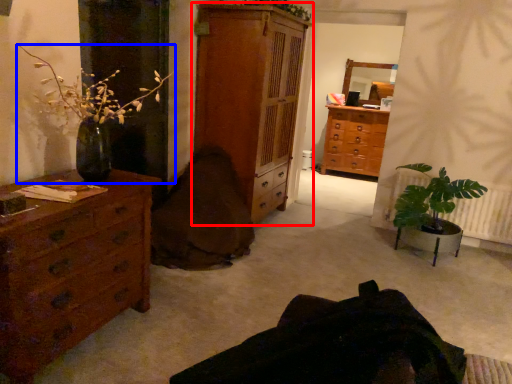
Question: Which object appears closest to the camera in this image, chest of drawers (highlighted by a red box) or houseplant (highlighted by a blue box)?

Choices:
 (A) chest of drawers
 (B) houseplant

Answer: (B)